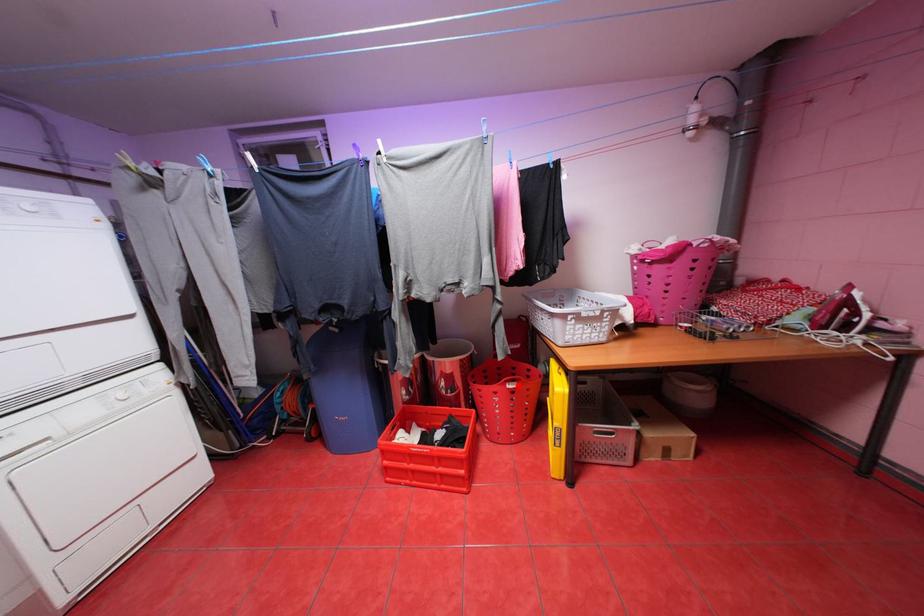
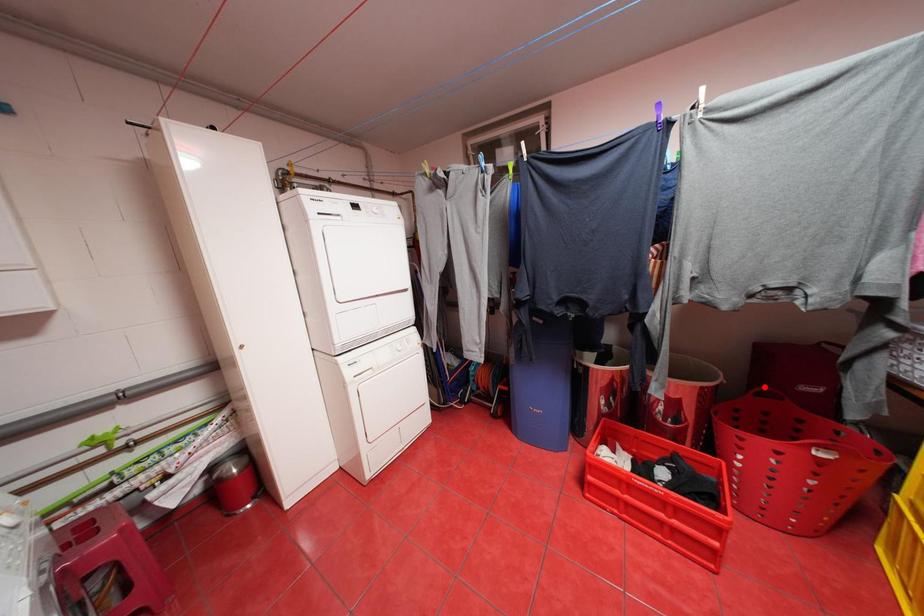
I am providing you with two images of the same scene from different viewpoints. A red point is marked on the first image and another point is marked on the second image. Is the red point in image1 aligned with the point shown in image2?

No